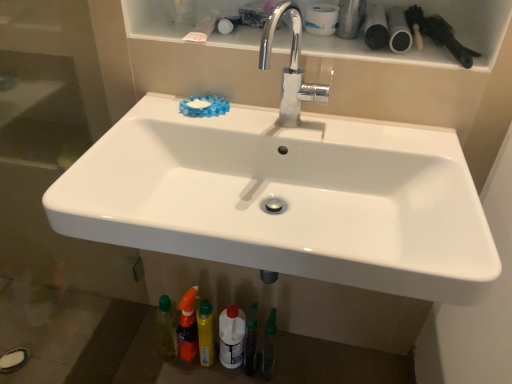
What do you see at coordinates (468, 23) in the screenshot? The width and height of the screenshot is (512, 384). I see `white glossy shelf at upper center` at bounding box center [468, 23].

Where is `chrome metallic faucet at upper center`? The height and width of the screenshot is (384, 512). chrome metallic faucet at upper center is located at coordinates (291, 68).

In order to face black matte brush at upper right, should I rotate leftwards or rightwards?

To align with it, rotate right about 24.018°.

The width and height of the screenshot is (512, 384). I want to click on translucent orange spray bottle at lower center, the second toiletry positioned from the right, so click(188, 326).

The height and width of the screenshot is (384, 512). Find the location of `translucent plastic bottle at lower center, the 1th toiletry when ordered from right to left`. translucent plastic bottle at lower center, the 1th toiletry when ordered from right to left is located at coordinates (251, 341).

The height and width of the screenshot is (384, 512). I want to click on white plastic bottle at lower center, so click(232, 336).

Find the location of a particular element. The height and width of the screenshot is (384, 512). sink located on the left of black matte brush at upper right is located at coordinates (287, 198).

Is white glossy sink at center situated inside black matte brush at upper right or outside?

white glossy sink at center is located beyond the bounds of black matte brush at upper right.

Would you consider white glossy sink at center to be distant from black matte brush at upper right?

That's not correct — white glossy sink at center is a little close to black matte brush at upper right.

Are white glossy shelf at upper center and white glossy sink at center far apart?

No.

Does white glossy shelf at upper center turn towards white glossy sink at center?

No, white glossy shelf at upper center does not turn towards white glossy sink at center.

From the image's perspective, is white glossy shelf at upper center above or below white glossy sink at center?

white glossy shelf at upper center is situated higher than white glossy sink at center in the image.

Consider the image. What's the angular difference between white glossy shelf at upper center and white glossy sink at center's facing directions?

There is a 0.103-degree angle between the facing directions of white glossy shelf at upper center and white glossy sink at center.

Choose the correct answer: Is chrome metallic faucet at upper center inside white glossy sink at center or outside it?

chrome metallic faucet at upper center is spatially situated outside white glossy sink at center.

Is chrome metallic faucet at upper center positioned far away from white glossy sink at center?

chrome metallic faucet at upper center is actually quite close to white glossy sink at center.

Is chrome metallic faucet at upper center smaller than white glossy sink at center?

Yes, chrome metallic faucet at upper center is smaller than white glossy sink at center.

Is chrome metallic faucet at upper center wider or thinner than white glossy sink at center?

chrome metallic faucet at upper center is thinner than white glossy sink at center.

Which object is thinner, white matte toilet paper at upper center or white glossy shelf at upper center?

white matte toilet paper at upper center is thinner.

Measure the distance between white matte toilet paper at upper center and white glossy shelf at upper center.

white matte toilet paper at upper center is 8.35 inches from white glossy shelf at upper center.

Would you say white matte toilet paper at upper center contains white glossy shelf at upper center?

Actually, white glossy shelf at upper center is outside white matte toilet paper at upper center.

From the image's perspective, between white matte toilet paper at upper center and white glossy shelf at upper center, which one is located above?

white matte toilet paper at upper center.

From a real-world perspective, does white matte toilet paper at upper center stand above translucent plastic bottle at lower center, the 1th toiletry when ordered from right to left?

Correct, in the physical world, white matte toilet paper at upper center is higher than translucent plastic bottle at lower center, the 1th toiletry when ordered from right to left.

Between white matte toilet paper at upper center and translucent plastic bottle at lower center, which appears as the second toiletry when viewed from the left, which one has larger width?

Wider between the two is white matte toilet paper at upper center.

Is white matte toilet paper at upper center shorter than translucent plastic bottle at lower center, the 1th toiletry when ordered from right to left?

Indeed, white matte toilet paper at upper center has a lesser height compared to translucent plastic bottle at lower center, the 1th toiletry when ordered from right to left.

Considering the sizes of objects translucent orange spray bottle at lower center, the first toiletry from the left, and white glossy sink at center in the image provided, who is smaller, translucent orange spray bottle at lower center, the first toiletry from the left, or white glossy sink at center?

With smaller size is translucent orange spray bottle at lower center, the first toiletry from the left.

Does point (192, 325) come in front of point (275, 162)?

No, (192, 325) is further to viewer.

Considering their positions, is translucent orange spray bottle at lower center, the first toiletry from the left, located in front of or behind white glossy sink at center?

translucent orange spray bottle at lower center, the first toiletry from the left, is positioned farther from the viewer than white glossy sink at center.

Can you tell me how much translucent orange spray bottle at lower center, the second toiletry positioned from the right, and white glossy sink at center differ in facing direction?

8.27 degrees.

Which is in front, point (442, 40) or point (420, 156)?

The point (420, 156) is in front.

Can you confirm if black matte brush at upper right is taller than white glossy sink at center?

No.

Which of these two, black matte brush at upper right or white glossy sink at center, is thinner?

With smaller width is black matte brush at upper right.

Is black matte brush at upper right oriented towards white glossy sink at center?

No.

Where is `sink below the black matte brush at upper right (from a real-world perspective)`? This screenshot has width=512, height=384. sink below the black matte brush at upper right (from a real-world perspective) is located at coordinates (287, 198).

Where is `shelf behind the white glossy sink at center`? The height and width of the screenshot is (384, 512). shelf behind the white glossy sink at center is located at coordinates (468, 23).

Based on their spatial positions, is white glossy sink at center or black matte brush at upper right closer to translucent orange spray bottle at lower center, the first toiletry from the left?

white glossy sink at center lies closer to translucent orange spray bottle at lower center, the first toiletry from the left, than the other object.

Estimate the real-world distances between objects in this image. Which object is further from translucent plastic bottle at lower center, the 1th toiletry when ordered from right to left, white plastic bottle at lower center or translucent orange spray bottle at lower center, the first toiletry from the left?

Based on the image, translucent orange spray bottle at lower center, the first toiletry from the left, appears to be further to translucent plastic bottle at lower center, the 1th toiletry when ordered from right to left.

From the image, which object appears to be farther from white plastic bottle at lower center, white glossy shelf at upper center or black matte brush at upper right?

Among the two, black matte brush at upper right is located further to white plastic bottle at lower center.

Based on the photo, estimate the real-world distances between objects in this image. Which object is further from chrome metallic faucet at upper center, translucent orange spray bottle at lower center, the first toiletry from the left, or white glossy sink at center?

translucent orange spray bottle at lower center, the first toiletry from the left, is further to chrome metallic faucet at upper center.

Consider the image. When comparing their distances from white matte toilet paper at upper center, does black matte brush at upper right or chrome metallic faucet at upper center seem further?

black matte brush at upper right lies further to white matte toilet paper at upper center than the other object.

Estimate the real-world distances between objects in this image. Which object is closer to translucent orange spray bottle at lower center, the first toiletry from the left, chrome metallic faucet at upper center or black matte brush at upper right?

chrome metallic faucet at upper center lies closer to translucent orange spray bottle at lower center, the first toiletry from the left, than the other object.

Considering their positions, is white glossy sink at center positioned further to white matte toilet paper at upper center than white glossy shelf at upper center?

white glossy sink at center.

From the image, which object appears to be farther from white matte toilet paper at upper center, black matte brush at upper right or white glossy shelf at upper center?

black matte brush at upper right is further to white matte toilet paper at upper center.

Where is `toiletry between chrome metallic faucet at upper center and translucent plastic bottle at lower center, the 1th toiletry when ordered from right to left, vertically`? This screenshot has width=512, height=384. toiletry between chrome metallic faucet at upper center and translucent plastic bottle at lower center, the 1th toiletry when ordered from right to left, vertically is located at coordinates (188, 326).

The image size is (512, 384). Identify the location of mouthwash positioned between white glossy sink at center and translucent orange spray bottle at lower center, the second toiletry positioned from the right, from near to far. (232, 336).

The width and height of the screenshot is (512, 384). I want to click on mouthwash between black matte brush at upper right and translucent plastic bottle at lower center, the 1th toiletry when ordered from right to left, vertically, so click(x=232, y=336).

Image resolution: width=512 pixels, height=384 pixels. What are the coordinates of `toiletry between black matte brush at upper right and translucent plastic bottle at lower center, the 1th toiletry when ordered from right to left, in the up-down direction` in the screenshot? It's located at (188, 326).